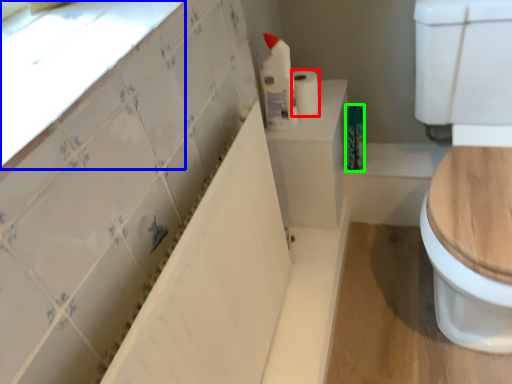
Question: Estimate the real-world distances between objects in this image. Which object is farther from toilet paper (highlighted by a red box), window sill (highlighted by a blue box) or toiletry (highlighted by a green box)?

Choices:
 (A) window sill
 (B) toiletry

Answer: (A)